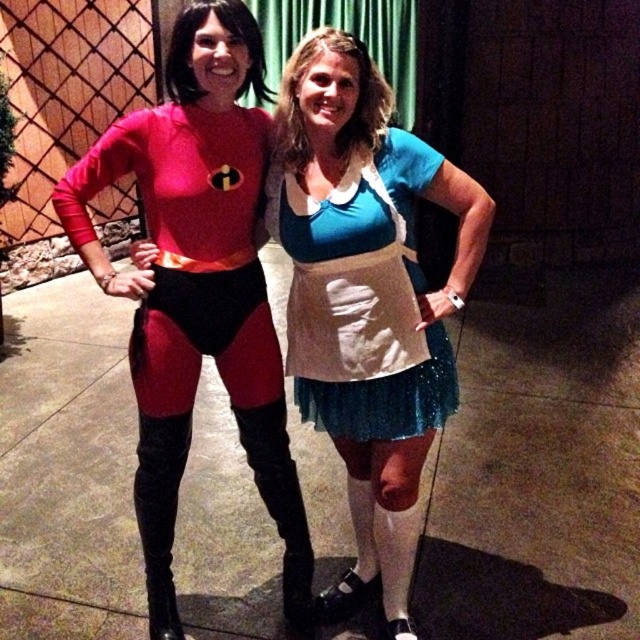
Who is lower down, blue satin dress at center or teal tulle dress at center?

blue satin dress at center is below.

Where is `blue satin dress at center`? The width and height of the screenshot is (640, 640). blue satin dress at center is located at coordinates (365, 298).

Identify the location of blue satin dress at center. Image resolution: width=640 pixels, height=640 pixels. (365, 298).

Who is positioned more to the left, shiny spandex suit at left or teal tulle dress at center?

Positioned to the left is shiny spandex suit at left.

Which is below, shiny spandex suit at left or teal tulle dress at center?

shiny spandex suit at left is below.

Find the location of a particular element. Image resolution: width=640 pixels, height=640 pixels. shiny spandex suit at left is located at coordinates (196, 285).

Does blue satin dress at center appear on the right side of shiny spandex suit at left?

Indeed, blue satin dress at center is positioned on the right side of shiny spandex suit at left.

Between blue satin dress at center and shiny spandex suit at left, which one is positioned higher?

shiny spandex suit at left is higher up.

Locate an element on the screen. This screenshot has width=640, height=640. blue satin dress at center is located at coordinates (365, 298).

The image size is (640, 640). What are the coordinates of `blue satin dress at center` in the screenshot? It's located at (365, 298).